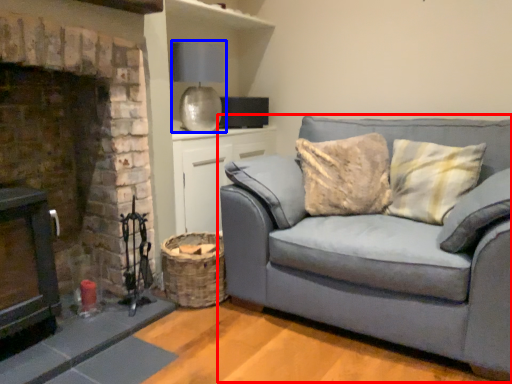
Question: Which of the following is the closest to the observer, studio couch (highlighted by a red box) or lamp (highlighted by a blue box)?

Choices:
 (A) studio couch
 (B) lamp

Answer: (A)